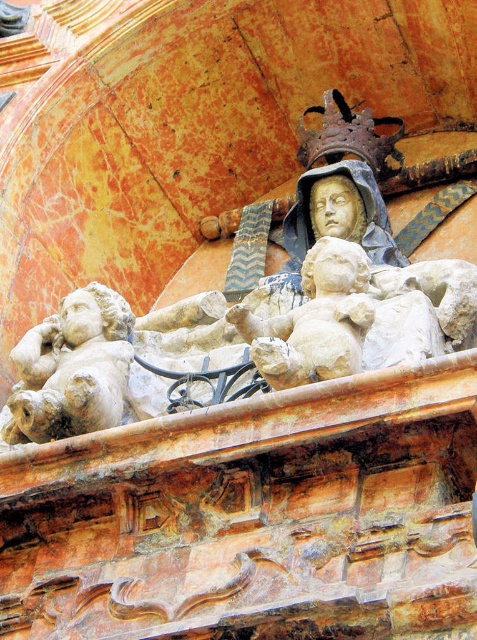
Who is more forward, (30,420) or (338,365)?

Point (338,365) is more forward.

Does white marble cherub at lower left have a lesser width compared to stone cherub at center?

Correct, white marble cherub at lower left's width is less than stone cherub at center's.

The height and width of the screenshot is (640, 477). What do you see at coordinates (72, 369) in the screenshot?
I see `white marble cherub at lower left` at bounding box center [72, 369].

Identify the location of white marble cherub at lower left. Image resolution: width=477 pixels, height=640 pixels. (72, 369).